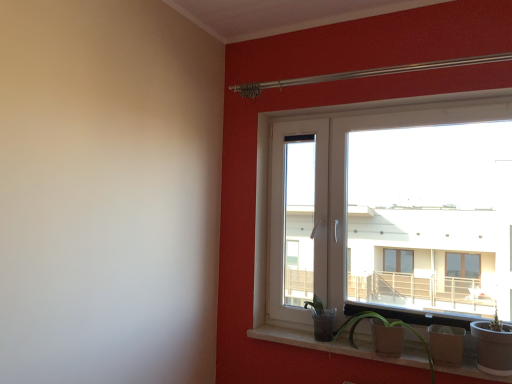
This screenshot has height=384, width=512. What do you see at coordinates (386, 209) in the screenshot?
I see `white plastic window at upper right` at bounding box center [386, 209].

What is the approximate height of green matte vase at lower center?

green matte vase at lower center is 9.08 inches tall.

What do you see at coordinates (382, 356) in the screenshot? I see `matte concrete window sill at lower center` at bounding box center [382, 356].

This screenshot has width=512, height=384. Identify the location of white plastic window at upper right. (386, 209).

Could you tell me if green matte vase at lower center is facing matte concrete window sill at lower center?

No, green matte vase at lower center is not facing towards matte concrete window sill at lower center.

Considering the relative sizes of green matte vase at lower center and matte concrete window sill at lower center in the image provided, is green matte vase at lower center thinner than matte concrete window sill at lower center?

Yes.

Is green matte vase at lower center spatially inside matte concrete window sill at lower center, or outside of it?

green matte vase at lower center is spatially situated outside matte concrete window sill at lower center.

From the image's perspective, would you say matte concrete window sill at lower center is positioned over green matte vase at lower center?

Actually, matte concrete window sill at lower center appears below green matte vase at lower center in the image.

Does matte concrete window sill at lower center have a greater width compared to green matte vase at lower center?

Indeed, matte concrete window sill at lower center has a greater width compared to green matte vase at lower center.

From a real-world perspective, which is physically above, matte concrete window sill at lower center or green matte vase at lower center?

In real-world perspective, green matte vase at lower center is above.

Which object is further away from the camera taking this photo, matte concrete window sill at lower center or green matte vase at lower center?

Result: green matte vase at lower center.

Is matte brown pot at lower right positioned far away from white plastic window at upper right?

No, matte brown pot at lower right is not far away from white plastic window at upper right.

Is matte brown pot at lower right to the left or to the right of white plastic window at upper right in the image?

From the image, it's evident that matte brown pot at lower right is to the left of white plastic window at upper right.

Considering the sizes of objects matte brown pot at lower right and white plastic window at upper right in the image provided, who is bigger, matte brown pot at lower right or white plastic window at upper right?

Bigger between the two is white plastic window at upper right.

Is green matte vase at lower center positioned in front of matte brown pot at lower right?

No.

Could you tell me if green matte vase at lower center is facing matte brown pot at lower right?

No.

Do you think green matte vase at lower center is within matte brown pot at lower right, or outside of it?

green matte vase at lower center is not inside matte brown pot at lower right, it's outside.

Find the location of a particular element. houseplant below the green matte vase at lower center (from the image's perspective) is located at coordinates (386, 328).

Which of these two, white plastic window at upper right or matte concrete window sill at lower center, is bigger?

With larger size is white plastic window at upper right.

Find the location of a particular element. This screenshot has width=512, height=384. window located behind the matte concrete window sill at lower center is located at coordinates (386, 209).

Looking at this image, considering the relative positions of white plastic window at upper right and matte concrete window sill at lower center in the image provided, is white plastic window at upper right to the right of matte concrete window sill at lower center from the viewer's perspective?

Correct, you'll find white plastic window at upper right to the right of matte concrete window sill at lower center.

Which is less distant, (412, 330) or (316, 328)?

Point (412, 330) appears to be closer to the viewer than point (316, 328).

Which object is thinner, matte brown pot at lower right or green matte vase at lower center?

green matte vase at lower center.

Is matte brown pot at lower right to the left or to the right of green matte vase at lower center in the image?

From the image, it's evident that matte brown pot at lower right is to the right of green matte vase at lower center.

Between white plastic window at upper right and green matte vase at lower center, which one has less height?

With less height is green matte vase at lower center.

Is white plastic window at upper right aimed at green matte vase at lower center?

Yes, white plastic window at upper right faces towards green matte vase at lower center.

Considering the sizes of objects white plastic window at upper right and green matte vase at lower center in the image provided, who is wider, white plastic window at upper right or green matte vase at lower center?

With larger width is white plastic window at upper right.

Image resolution: width=512 pixels, height=384 pixels. I want to click on plant that appears above the matte concrete window sill at lower center (from the image's perspective), so click(322, 319).

Where is `window sill that appears below the green matte vase at lower center (from a real-world perspective)`? The width and height of the screenshot is (512, 384). window sill that appears below the green matte vase at lower center (from a real-world perspective) is located at coordinates (382, 356).

Looking at this image, which object lies nearer to the anchor point green matte vase at lower center, matte brown pot at lower right or matte concrete window sill at lower center?

Based on the image, matte brown pot at lower right appears to be nearer to green matte vase at lower center.

From the image, which object appears to be farther from green matte vase at lower center, matte concrete window sill at lower center or white plastic window at upper right?

white plastic window at upper right.

From the image, which object appears to be nearer to green matte vase at lower center, white plastic window at upper right or matte brown pot at lower right?

matte brown pot at lower right is closer to green matte vase at lower center.

Based on their spatial positions, is green matte vase at lower center or white plastic window at upper right further from matte brown pot at lower right?

white plastic window at upper right is further to matte brown pot at lower right.

Based on their spatial positions, is white plastic window at upper right or green matte vase at lower center closer to matte concrete window sill at lower center?

green matte vase at lower center lies closer to matte concrete window sill at lower center than the other object.

Considering their positions, is white plastic window at upper right positioned closer to matte brown pot at lower right than green matte vase at lower center?

green matte vase at lower center is closer to matte brown pot at lower right.

From the image, which object appears to be farther from matte brown pot at lower right, white plastic window at upper right or matte concrete window sill at lower center?

white plastic window at upper right lies further to matte brown pot at lower right than the other object.

When comparing their distances from white plastic window at upper right, does matte concrete window sill at lower center or green matte vase at lower center seem closer?

Based on the image, matte concrete window sill at lower center appears to be nearer to white plastic window at upper right.

Locate an element on the screen. Image resolution: width=512 pixels, height=384 pixels. plant that lies between white plastic window at upper right and matte brown pot at lower right from top to bottom is located at coordinates (322, 319).

Identify the location of houseplant between white plastic window at upper right and matte concrete window sill at lower center in the up-down direction. (386, 328).

Find the location of `window sill located between matte brown pot at lower right and green matte vase at lower center in the depth direction`. window sill located between matte brown pot at lower right and green matte vase at lower center in the depth direction is located at coordinates (382, 356).

Locate an element on the screen. This screenshot has width=512, height=384. plant between white plastic window at upper right and matte concrete window sill at lower center in the vertical direction is located at coordinates (322, 319).